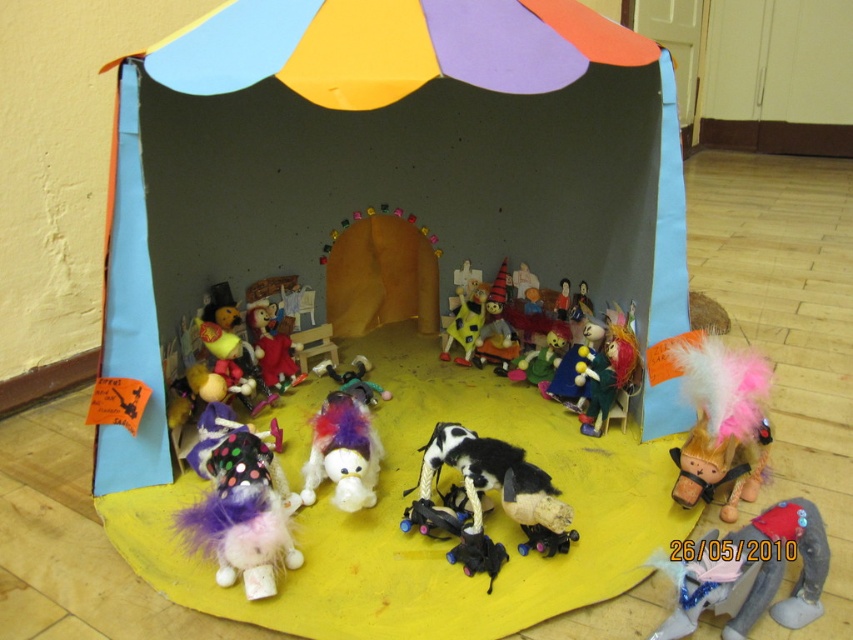
Is feathered brown horse at right above fuzzy black and white dog at center?

Incorrect, feathered brown horse at right is not positioned above fuzzy black and white dog at center.

Which is in front, point (691, 480) or point (364, 400)?

Positioned in front is point (691, 480).

The height and width of the screenshot is (640, 853). I want to click on feathered brown horse at right, so click(x=721, y=420).

Does cardboard tent at center have a lesser height compared to fuzzy black and white dog at center?

In fact, cardboard tent at center may be taller than fuzzy black and white dog at center.

Can you confirm if cardboard tent at center is wider than fuzzy black and white dog at center?

Correct, the width of cardboard tent at center exceeds that of fuzzy black and white dog at center.

Who is more forward, (325, 104) or (349, 387)?

Point (325, 104)

This screenshot has width=853, height=640. Identify the location of cardboard tent at center. (383, 172).

Which is behind, point (106, 308) or point (730, 353)?

The point (730, 353) is more distant.

Is cardboard tent at center bigger than feathered brown horse at right?

Yes, cardboard tent at center is bigger than feathered brown horse at right.

Between point (242, 20) and point (757, 458), which one is positioned in front?

Point (242, 20)

At what (x,y) coordinates should I click in order to perform the action: click on cardboard tent at center. Please return your answer as a coordinate pair (x, y). Looking at the image, I should click on (383, 172).